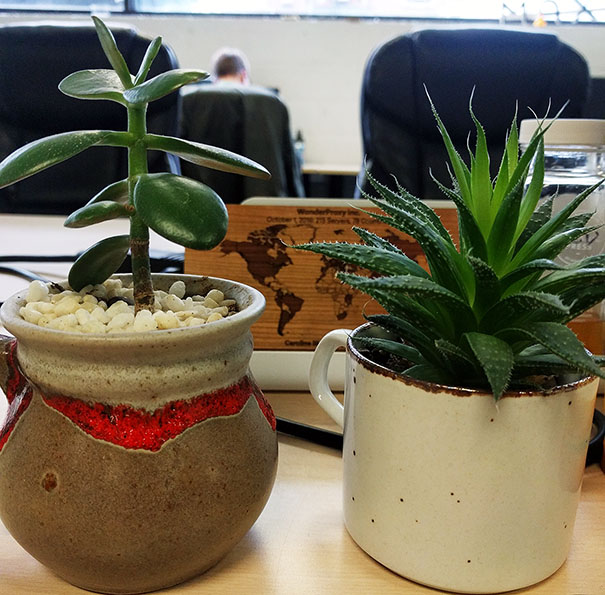
You are a GUI agent. You are given a task and a screenshot of the screen. Output one action in this format:
    pyautogui.click(x=<x>, y=<y>)
    Task: Click on the glass
    
    Given the screenshot: What is the action you would take?
    pyautogui.click(x=569, y=194)